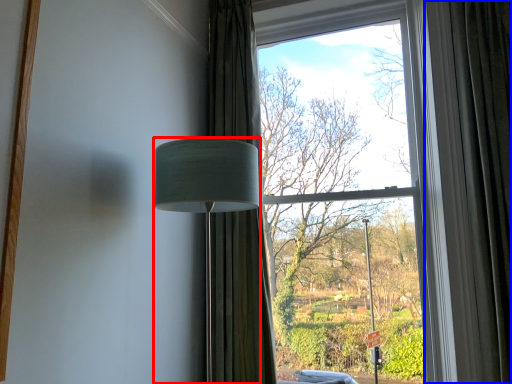
Question: Among these objects, which one is farthest to the camera, lamp (highlighted by a red box) or curtain (highlighted by a blue box)?

Choices:
 (A) lamp
 (B) curtain

Answer: (B)